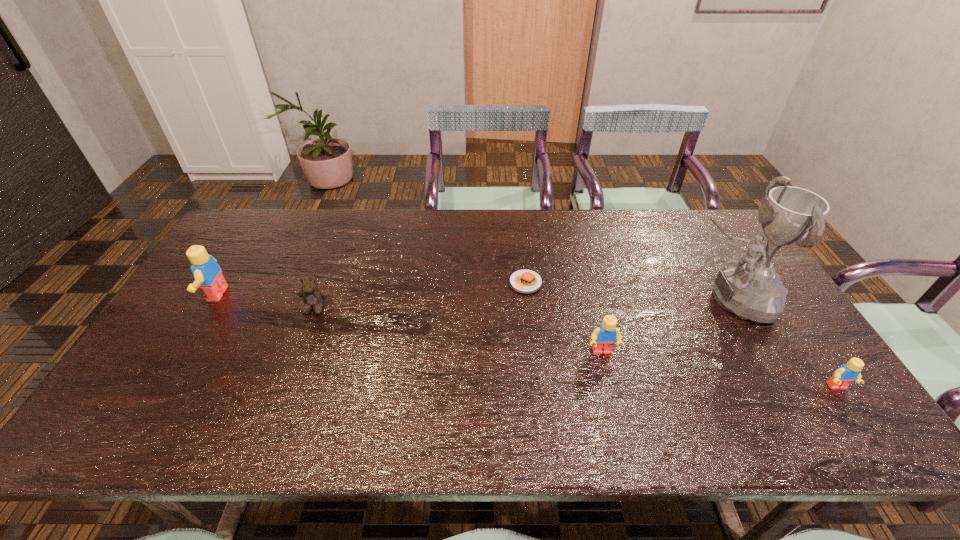
Locate an element on the screen. The image size is (960, 540). vacant area between the tallest object and the shortest object is located at coordinates (629, 291).

The width and height of the screenshot is (960, 540). What are the coordinates of `free space between the tallest object and the nearest object` in the screenshot? It's located at [x=784, y=343].

Where is `vacant area that lies between the teddy bear and the second Lego from left to right`? The width and height of the screenshot is (960, 540). vacant area that lies between the teddy bear and the second Lego from left to right is located at coordinates (459, 329).

The image size is (960, 540). I want to click on free spot between the third object from right to left and the teddy bear, so click(459, 329).

Find the location of a particular element. Image resolution: width=960 pixels, height=540 pixels. free space between the second tallest object and the shortest Lego is located at coordinates (526, 340).

At what (x,y) coordinates should I click in order to perform the action: click on object that is the second closest to the second tallest object. Please return your answer as a coordinate pair (x, y). This screenshot has height=540, width=960. Looking at the image, I should click on (523, 281).

The image size is (960, 540). I want to click on object that ranks as the third closest to the shortest Lego, so click(x=523, y=281).

Identify which Lego is the third nearest to the third object from left to right. Please provide its 2D coordinates. Your answer should be formatted as a tuple, i.e. [(x, y)], where the tuple contains the x and y coordinates of a point satisfying the conditions above.

[(208, 275)]

Identify the location of the second closest Lego to the award. (604, 337).

The height and width of the screenshot is (540, 960). I want to click on vacant area in the image that satisfies the following two spatial constraints: 1. on the side with emblem of the award; 2. on the front-facing side of the fourth object from left to right, so click(x=762, y=352).